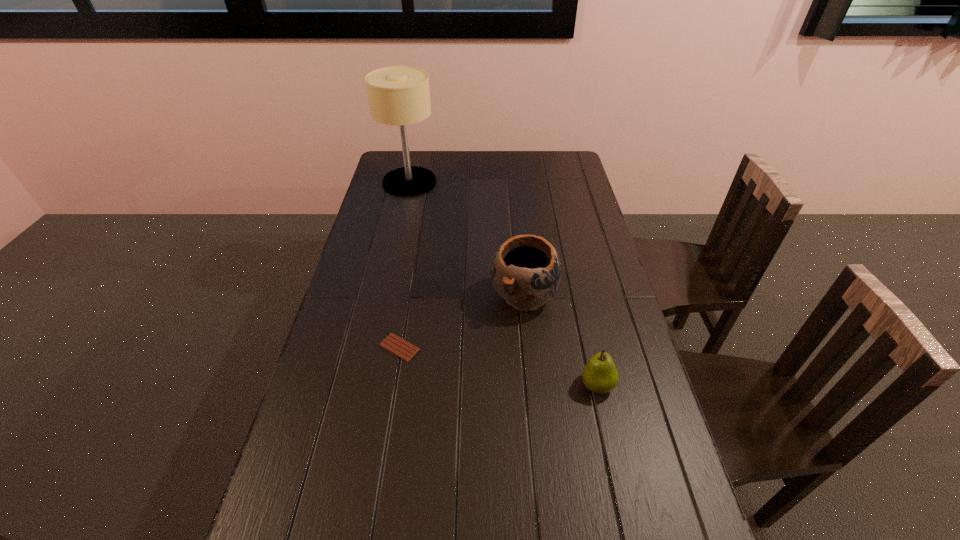
Locate an element on the screen. The image size is (960, 540). free space that is in between the shortest object and the pottery is located at coordinates (462, 321).

Identify the location of object that stands as the third closest to the third nearest object. (398, 95).

Identify which object is the third closest to the candy bar. Please provide its 2D coordinates. Your answer should be formatted as a tuple, i.e. [(x, y)], where the tuple contains the x and y coordinates of a point satisfying the conditions above.

[(398, 95)]

The image size is (960, 540). Identify the location of free space that satisfies the following two spatial constraints: 1. on the back side of the shortest object; 2. on the left side of the second object from right to left. (408, 295).

Where is `vacant space that satisfies the following two spatial constraints: 1. on the back side of the third farthest object; 2. on the right side of the second object from right to left`? vacant space that satisfies the following two spatial constraints: 1. on the back side of the third farthest object; 2. on the right side of the second object from right to left is located at coordinates (408, 295).